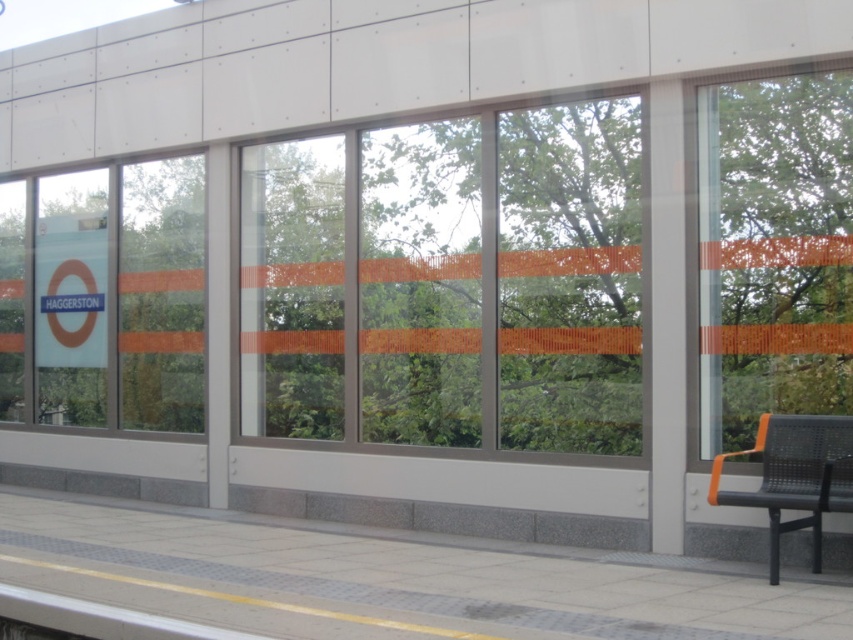
Question: Can you confirm if transparent glass window at right is smaller than matte glass window at left?

Choices:
 (A) no
 (B) yes

Answer: (B)

Question: Estimate the real-world distances between objects in this image. Which object is farther from the matte glass window at left?

Choices:
 (A) transparent glass window at right
 (B) transparent glass window at center

Answer: (A)

Question: Among these points, which one is nearest to the camera?

Choices:
 (A) (622, 195)
 (B) (788, 413)
 (C) (143, 330)

Answer: (B)

Question: Can you confirm if transparent glass window at center is positioned below matte glass window at left?

Choices:
 (A) yes
 (B) no

Answer: (B)

Question: Is transparent glass window at center wider than transparent glass window at right?

Choices:
 (A) no
 (B) yes

Answer: (B)

Question: Among these points, which one is nearest to the camera?

Choices:
 (A) (799, 224)
 (B) (171, 314)
 (C) (772, 515)
 (D) (537, 262)

Answer: (C)